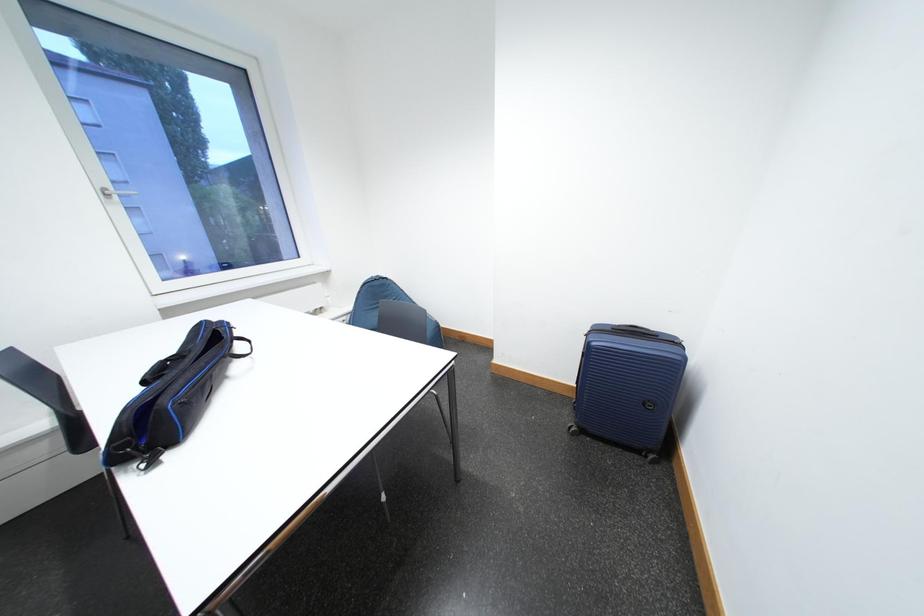
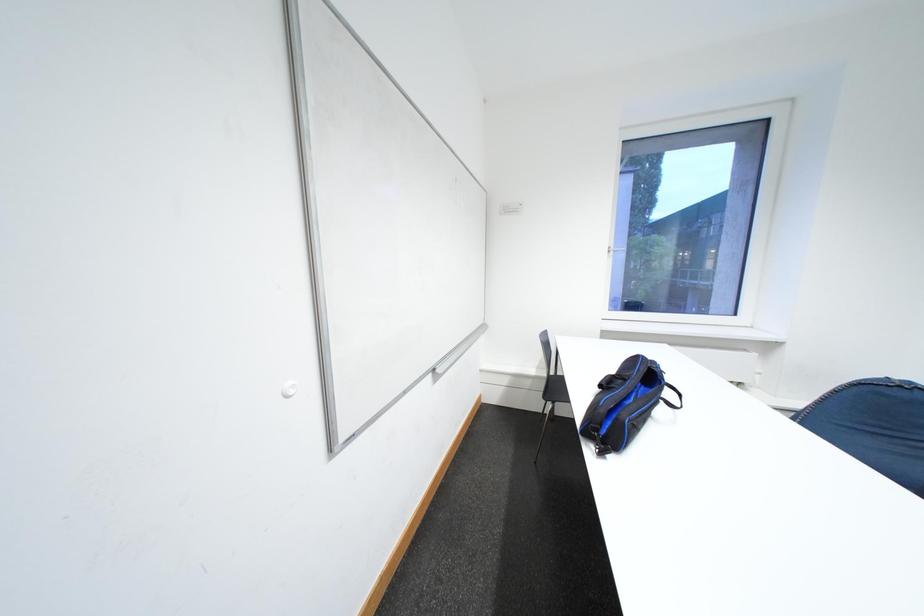
Question: The camera is either moving clockwise (left) or counter-clockwise (right) around the object. The first image is from the beginning of the video and the second image is from the end. Is the camera moving left or right when shooting the video?

Choices:
 (A) Left
 (B) Right

Answer: (B)